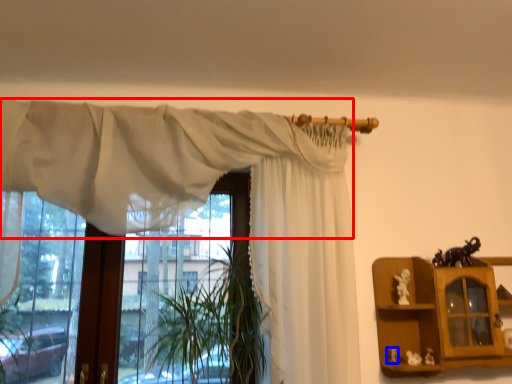
Question: Which object appears farthest to the camera in this image, curtain (highlighted by a red box) or toy (highlighted by a blue box)?

Choices:
 (A) curtain
 (B) toy

Answer: (B)